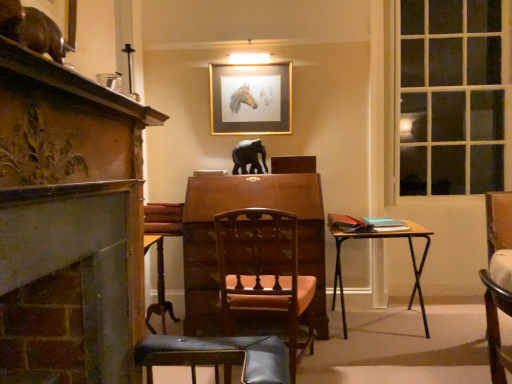
Question: Looking at the image, does carved wood fireplace at left seem bigger or smaller compared to clear glass window at right?

Choices:
 (A) small
 (B) big

Answer: (A)

Question: Visually, is carved wood fireplace at left positioned to the left or to the right of clear glass window at right?

Choices:
 (A) right
 (B) left

Answer: (B)

Question: Based on their relative distances, which object is farther from the carved wood fireplace at left?

Choices:
 (A) wooden chair at center, the 1th chair positioned from the left
 (B) gold metallic picture frame at upper center
 (C) wooden chair with carved backrest at center, the 2th chair from the right
 (D) wooden chair at right, which is the third chair from left to right
 (E) clear glass window at right

Answer: (E)

Question: Estimate the real-world distances between objects in this image. Which object is farther from the carved wood fireplace at left?

Choices:
 (A) gold metallic picture frame at upper center
 (B) clear glass window at right
 (C) wooden chair at center, the 1th chair positioned from the left
 (D) wooden chair with carved backrest at center, the 2th chair positioned from the left
 (E) shiny brown cat at upper left, the first animal in the front-to-back sequence

Answer: (B)